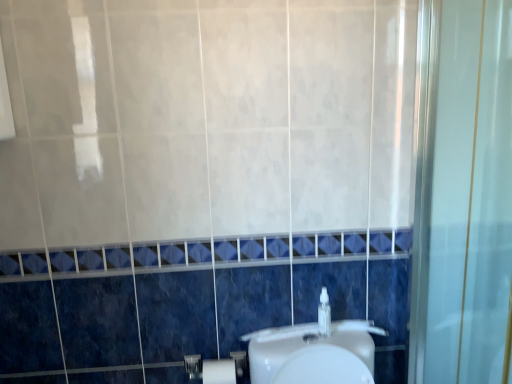
Question: From the image's perspective, relative to white matte toilet paper at lower center, is clear plastic bottle at center above or below?

Choices:
 (A) below
 (B) above

Answer: (B)

Question: Considering the positions of clear plastic bottle at center and white matte toilet paper at lower center in the image, is clear plastic bottle at center taller or shorter than white matte toilet paper at lower center?

Choices:
 (A) tall
 (B) short

Answer: (B)

Question: Is clear plastic bottle at center situated inside white matte toilet paper at lower center or outside?

Choices:
 (A) outside
 (B) inside

Answer: (A)

Question: From a real-world perspective, is white matte toilet paper at lower center positioned above or below clear plastic bottle at center?

Choices:
 (A) above
 (B) below

Answer: (B)

Question: Is white matte toilet paper at lower center spatially inside clear plastic bottle at center, or outside of it?

Choices:
 (A) outside
 (B) inside

Answer: (A)

Question: In terms of width, does white matte toilet paper at lower center look wider or thinner when compared to clear plastic bottle at center?

Choices:
 (A) wide
 (B) thin

Answer: (A)

Question: In terms of height, does white matte toilet paper at lower center look taller or shorter compared to clear plastic bottle at center?

Choices:
 (A) tall
 (B) short

Answer: (A)